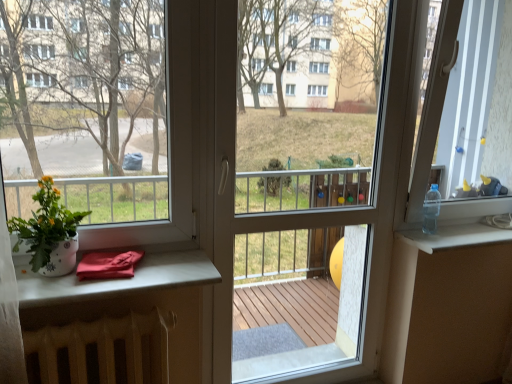
What is the approximate width of matte white table at lower left, which is the second table from bottom to top?

12.02 inches.

What is the approximate height of clear plastic bottle at upper right?

9.17 inches.

Measure the distance between clear plastic bottle at upper right and camera.

clear plastic bottle at upper right is 6.20 feet from camera.

The height and width of the screenshot is (384, 512). Describe the element at coordinates (467, 109) in the screenshot. I see `transparent plastic bottle at right` at that location.

Describe the element at coordinates (455, 236) in the screenshot. The height and width of the screenshot is (384, 512). I see `transparent plastic bottle at upper right` at that location.

Image resolution: width=512 pixels, height=384 pixels. Identify the location of matte white table at lower left, which is the second table from bottom to top. (118, 280).

From a real-world perspective, is transparent plastic bottle at upper right on top of transparent plastic screen door at center?

No, from a real-world perspective, transparent plastic bottle at upper right is not above transparent plastic screen door at center.

Is transparent plastic bottle at upper right taller than transparent plastic screen door at center?

In fact, transparent plastic bottle at upper right may be shorter than transparent plastic screen door at center.

From the image's perspective, is transparent plastic bottle at upper right above or below transparent plastic screen door at center?

transparent plastic bottle at upper right is below transparent plastic screen door at center.

Can you tell me how much transparent plastic screen door at center and matte white table at lower left, placed as the 1th table when sorted from top to bottom, differ in facing direction?

transparent plastic screen door at center and matte white table at lower left, placed as the 1th table when sorted from top to bottom, are facing 1.25 degrees away from each other.

In terms of size, does transparent plastic screen door at center appear bigger or smaller than matte white table at lower left, which is the second table from bottom to top?

In the image, transparent plastic screen door at center appears to be larger than matte white table at lower left, which is the second table from bottom to top.

Is point (314, 214) farther from viewer compared to point (124, 282)?

Yes, it is.

Looking at this image, does clear plastic bottle at upper right have a greater width compared to transparent plastic bottle at right?

Incorrect, the width of clear plastic bottle at upper right does not surpass that of transparent plastic bottle at right.

Is clear plastic bottle at upper right closer to the viewer compared to transparent plastic bottle at right?

No.

Based on the photo, from a real-world perspective, which is physically above, clear plastic bottle at upper right or transparent plastic bottle at right?

From a 3D spatial view, transparent plastic bottle at right is above.

Is clear plastic bottle at upper right smaller than transparent plastic bottle at right?

Indeed, clear plastic bottle at upper right has a smaller size compared to transparent plastic bottle at right.

Is transparent plastic bottle at right to the left or to the right of transparent plastic screen door at center in the image?

In the image, transparent plastic bottle at right appears on the right side of transparent plastic screen door at center.

How distant is transparent plastic bottle at right from transparent plastic screen door at center?

A distance of 1.02 meters exists between transparent plastic bottle at right and transparent plastic screen door at center.

Locate an element on the screen. This screenshot has width=512, height=384. window screen behind the transparent plastic screen door at center is located at coordinates (467, 109).

Considering the positions of points (511, 91) and (277, 327), is point (511, 91) farther from camera compared to point (277, 327)?

No, it is not.

Between white radiator at lower left, the 1th table positioned from the bottom, and transparent plastic bottle at right, which one is positioned in front?

white radiator at lower left, the 1th table positioned from the bottom, is in front.

From a real-world perspective, which object stands above the other?

transparent plastic bottle at right is physically above.

Which of these two, white radiator at lower left, marked as the 2th table in a top-to-bottom arrangement, or transparent plastic bottle at right, is bigger?

Bigger between the two is transparent plastic bottle at right.

Based on their positions, is white radiator at lower left, the 1th table positioned from the bottom, located to the left or right of transparent plastic bottle at right?

white radiator at lower left, the 1th table positioned from the bottom, is positioned on transparent plastic bottle at right's left side.

Considering the relative sizes of transparent plastic bottle at upper right and white radiator at lower left, marked as the 2th table in a top-to-bottom arrangement, in the image provided, is transparent plastic bottle at upper right taller than white radiator at lower left, marked as the 2th table in a top-to-bottom arrangement,?

No, transparent plastic bottle at upper right is not taller than white radiator at lower left, marked as the 2th table in a top-to-bottom arrangement.

Considering the sizes of objects transparent plastic bottle at upper right and white radiator at lower left, marked as the 2th table in a top-to-bottom arrangement, in the image provided, who is wider, transparent plastic bottle at upper right or white radiator at lower left, marked as the 2th table in a top-to-bottom arrangement,?

transparent plastic bottle at upper right is wider.

Is transparent plastic bottle at upper right facing towards white radiator at lower left, the 1th table positioned from the bottom?

No, transparent plastic bottle at upper right does not turn towards white radiator at lower left, the 1th table positioned from the bottom.

Is transparent plastic bottle at upper right positioned in front of white radiator at lower left, marked as the 2th table in a top-to-bottom arrangement?

No, the depth of transparent plastic bottle at upper right is greater than that of white radiator at lower left, marked as the 2th table in a top-to-bottom arrangement.

Is white radiator at lower left, marked as the 2th table in a top-to-bottom arrangement, oriented towards matte white table at lower left, which is the second table from bottom to top?

No, white radiator at lower left, marked as the 2th table in a top-to-bottom arrangement, is not turned towards matte white table at lower left, which is the second table from bottom to top.

Which of these two, white radiator at lower left, the 1th table positioned from the bottom, or matte white table at lower left, placed as the 1th table when sorted from top to bottom, is smaller?

matte white table at lower left, placed as the 1th table when sorted from top to bottom.

Does point (172, 342) appear closer or farther from the camera than point (176, 259)?

Point (172, 342) is positioned closer to the camera compared to point (176, 259).

Where is `screen door above the transparent plastic bottle at upper right (from the image's perspective)`? screen door above the transparent plastic bottle at upper right (from the image's perspective) is located at coordinates (321, 246).

Where is `the 1st table positioned below the transparent plastic screen door at center (from the image's perspective)`? The height and width of the screenshot is (384, 512). the 1st table positioned below the transparent plastic screen door at center (from the image's perspective) is located at coordinates (118, 280).

Which object lies further to the anchor point transparent plastic screen door at center, matte white table at lower left, placed as the 1th table when sorted from top to bottom, or clear plastic bottle at upper right?

Based on the image, clear plastic bottle at upper right appears to be further to transparent plastic screen door at center.

When comparing their distances from white radiator at lower left, marked as the 2th table in a top-to-bottom arrangement, does clear plastic bottle at upper right or white glossy flower pot at left seem closer?

white glossy flower pot at left is positioned closer to the anchor white radiator at lower left, marked as the 2th table in a top-to-bottom arrangement.

Which object lies further to the anchor point clear plastic bottle at upper right, white radiator at lower left, marked as the 2th table in a top-to-bottom arrangement, or white glossy flower pot at left?

white glossy flower pot at left is further to clear plastic bottle at upper right.

Which object lies nearer to the anchor point matte white table at lower left, which is the second table from bottom to top, clear plastic bottle at upper right or white glossy pot at left?

Among the two, white glossy pot at left is located nearer to matte white table at lower left, which is the second table from bottom to top.

Which object lies further to the anchor point transparent plastic bottle at right, matte white table at lower left, placed as the 1th table when sorted from top to bottom, or transparent plastic bottle at upper right?

Based on the image, matte white table at lower left, placed as the 1th table when sorted from top to bottom, appears to be further to transparent plastic bottle at right.

When comparing their distances from transparent plastic bottle at upper right, does matte white table at lower left, which is the second table from bottom to top, or white glossy pot at left seem closer?

Based on the image, matte white table at lower left, which is the second table from bottom to top, appears to be nearer to transparent plastic bottle at upper right.

Based on their spatial positions, is white glossy flower pot at left or transparent plastic screen door at center closer to clear plastic bottle at upper right?

transparent plastic screen door at center lies closer to clear plastic bottle at upper right than the other object.

From the image, which object appears to be nearer to transparent plastic bottle at right, white glossy pot at left or clear plastic bottle at upper right?

Based on the image, clear plastic bottle at upper right appears to be nearer to transparent plastic bottle at right.

What are the coordinates of `screen door between white radiator at lower left, the 1th table positioned from the bottom, and transparent plastic bottle at upper right` in the screenshot? It's located at (321, 246).

What are the coordinates of `window sill located between white radiator at lower left, marked as the 2th table in a top-to-bottom arrangement, and transparent plastic bottle at right in the left-right direction` in the screenshot? It's located at (455, 236).

Where is `screen door between white glossy pot at left and transparent plastic bottle at right`? screen door between white glossy pot at left and transparent plastic bottle at right is located at coordinates (321, 246).

Find the location of a particular element. The image size is (512, 384). table between white glossy flower pot at left and white radiator at lower left, marked as the 2th table in a top-to-bottom arrangement, in the up-down direction is located at coordinates (118, 280).